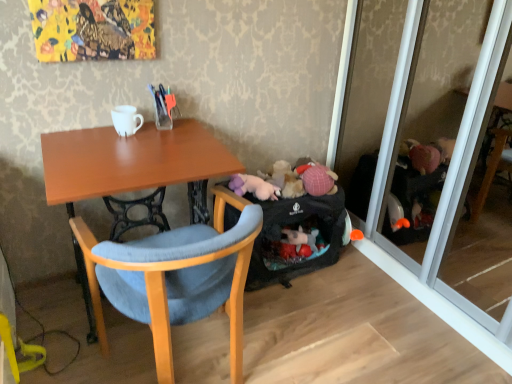
At what (x,y) coordinates should I click in order to perform the action: click on white glossy coffee cup at upper center. Please return your answer as a coordinate pair (x, y). Looking at the image, I should click on (126, 120).

The height and width of the screenshot is (384, 512). In order to click on wooden chair at center in this screenshot , I will do `click(176, 278)`.

Where is `white glossy coffee cup at upper center`? white glossy coffee cup at upper center is located at coordinates pyautogui.click(x=126, y=120).

Is wooden chair at center bigger or smaller than transparent glass screen door at right?

Clearly, wooden chair at center is smaller in size than transparent glass screen door at right.

Based on the photo, is transparent glass screen door at right surrounded by wooden chair at center?

That's incorrect, transparent glass screen door at right is not inside wooden chair at center.

Are wooden chair at center and transparent glass screen door at right making contact?

No, wooden chair at center is not making contact with transparent glass screen door at right.

Does point (184, 269) lie behind point (490, 315)?

No, it is not.

Is the surface of wooden chair at center in direct contact with wooden table at center?

They are not placed beside each other.

Can you confirm if wooden chair at center is positioned to the right of wooden table at center?

Correct, you'll find wooden chair at center to the right of wooden table at center.

From a real-world perspective, is wooden chair at center on top of wooden table at center?

No, from a real-world perspective, wooden chair at center is not above wooden table at center.

Does wooden chair at center contain wooden table at center?

That's correct, wooden table at center is inside wooden chair at center.

How much distance is there between black fabric luggage at lower right and wooden chair at center?

black fabric luggage at lower right is 20.06 inches away from wooden chair at center.

Locate an element on the screen. Image resolution: width=512 pixels, height=384 pixels. chair below the black fabric luggage at lower right (from the image's perspective) is located at coordinates (176, 278).

Does black fabric luggage at lower right lie behind wooden chair at center?

Yes, black fabric luggage at lower right is further from the camera.

Is point (478, 14) more distant than point (118, 124)?

Yes, it is behind point (118, 124).

Considering the positions of objects transparent glass screen door at right and white glossy coffee cup at upper center in the image provided, who is behind, transparent glass screen door at right or white glossy coffee cup at upper center?

white glossy coffee cup at upper center is further from the camera.

Where is `screen door in front of the white glossy coffee cup at upper center`? Image resolution: width=512 pixels, height=384 pixels. screen door in front of the white glossy coffee cup at upper center is located at coordinates (440, 149).

Is white glossy coffee cup at upper center inside transparent glass screen door at right?

That's incorrect, white glossy coffee cup at upper center is not inside transparent glass screen door at right.

Looking at this image, from the image's perspective, who appears lower, wooden chair at center or white glossy coffee cup at upper center?

wooden chair at center, from the image's perspective.

Considering the relative positions of wooden chair at center and white glossy coffee cup at upper center in the image provided, is wooden chair at center to the left of white glossy coffee cup at upper center from the viewer's perspective?

No.

Based on the photo, would you consider wooden chair at center to be distant from white glossy coffee cup at upper center?

wooden chair at center is near white glossy coffee cup at upper center, not far away.

Can you confirm if wooden chair at center is taller than white glossy coffee cup at upper center?

Yes.

Which is closer to the camera, (126, 133) or (268, 207)?

Point (126, 133) appears to be closer to the viewer than point (268, 207).

Could black fabric luggage at lower right be considered to be inside white glossy coffee cup at upper center?

No, black fabric luggage at lower right is located outside of white glossy coffee cup at upper center.

You are a GUI agent. You are given a task and a screenshot of the screen. Output one action in this format:
    pyautogui.click(x=<x>, y=<y>)
    Task: Click on the coffee cup that appears in front of the black fabric luggage at lower right
    The image size is (512, 384).
    Given the screenshot: What is the action you would take?
    pyautogui.click(x=126, y=120)

At what (x,y) coordinates should I click in order to perform the action: click on screen door above the wooden table at center (from a real-world perspective). Please return your answer as a coordinate pair (x, y). Image resolution: width=512 pixels, height=384 pixels. Looking at the image, I should click on (440, 149).

From the image's perspective, is transparent glass screen door at right above or below wooden table at center?

From the image's perspective, transparent glass screen door at right appears above wooden table at center.

Is transparent glass screen door at right bigger or smaller than wooden table at center?

Clearly, transparent glass screen door at right is larger in size than wooden table at center.

Which object is positioned more to the left, transparent glass screen door at right or wooden table at center?

wooden table at center is more to the left.

Image resolution: width=512 pixels, height=384 pixels. Find the location of `chair lying below the transparent glass screen door at right (from the image's perspective)`. chair lying below the transparent glass screen door at right (from the image's perspective) is located at coordinates (176, 278).

Identify the location of chair that appears in front of the wooden table at center. The image size is (512, 384). (176, 278).

From the image, which object appears to be nearer to wooden chair at center, white glossy coffee cup at upper center or wooden table at center?

wooden table at center lies closer to wooden chair at center than the other object.

Which object lies further to the anchor point transparent glass screen door at right, black fabric luggage at lower right or wooden chair at center?

wooden chair at center lies further to transparent glass screen door at right than the other object.

From the image, which object appears to be nearer to wooden chair at center, white glossy coffee cup at upper center or black fabric luggage at lower right?

The object closer to wooden chair at center is black fabric luggage at lower right.

Looking at the image, which one is located closer to white glossy coffee cup at upper center, wooden chair at center or wooden table at center?

wooden table at center is closer to white glossy coffee cup at upper center.

From the image, which object appears to be farther from transparent glass screen door at right, black fabric luggage at lower right or wooden table at center?

The object further to transparent glass screen door at right is wooden table at center.

Which object lies further to the anchor point wooden table at center, wooden chair at center or transparent glass screen door at right?

Among the two, transparent glass screen door at right is located further to wooden table at center.

In the scene shown: Based on their spatial positions, is wooden chair at center or white glossy coffee cup at upper center closer to transparent glass screen door at right?

Based on the image, wooden chair at center appears to be nearer to transparent glass screen door at right.

Based on their spatial positions, is transparent glass screen door at right or wooden chair at center closer to black fabric luggage at lower right?

wooden chair at center is positioned closer to the anchor black fabric luggage at lower right.

Identify the location of desk positioned between wooden chair at center and white glossy coffee cup at upper center from near to far. The width and height of the screenshot is (512, 384). (134, 163).

Identify the location of desk situated between white glossy coffee cup at upper center and black fabric luggage at lower right from left to right. The height and width of the screenshot is (384, 512). (134, 163).

The image size is (512, 384). In order to click on luggage and bags between wooden chair at center and transparent glass screen door at right from left to right in this screenshot , I will do `click(296, 228)`.

Locate an element on the screen. luggage and bags situated between white glossy coffee cup at upper center and transparent glass screen door at right from left to right is located at coordinates (296, 228).